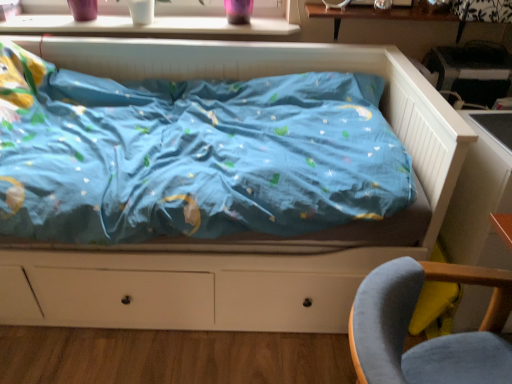
Question: Is velvet grey chair at lower right further to the viewer compared to matte blue bed at center?

Choices:
 (A) no
 (B) yes

Answer: (A)

Question: Considering the relative sizes of velvet grey chair at lower right and matte blue bed at center in the image provided, is velvet grey chair at lower right thinner than matte blue bed at center?

Choices:
 (A) yes
 (B) no

Answer: (A)

Question: Is velvet grey chair at lower right closer to camera compared to matte blue bed at center?

Choices:
 (A) no
 (B) yes

Answer: (B)

Question: Is velvet grey chair at lower right smaller than matte blue bed at center?

Choices:
 (A) yes
 (B) no

Answer: (A)

Question: Is velvet grey chair at lower right taller than matte blue bed at center?

Choices:
 (A) no
 (B) yes

Answer: (A)

Question: Would you say white glossy window sill at upper center is inside or outside wooden table at upper center, the 1th table from the top?

Choices:
 (A) outside
 (B) inside

Answer: (A)

Question: Does point (69, 18) appear closer or farther from the camera than point (394, 6)?

Choices:
 (A) closer
 (B) farther

Answer: (B)

Question: Considering their positions, is white glossy window sill at upper center located in front of or behind wooden table at upper center, the 1th table from the top?

Choices:
 (A) behind
 (B) front

Answer: (A)

Question: Is white glossy window sill at upper center wider or thinner than wooden table at upper center, the 1th table from the top?

Choices:
 (A) thin
 (B) wide

Answer: (B)

Question: Looking at their shapes, would you say white wood table at right, which ranks as the second table in top-to-bottom order, is wider or thinner than velvet grey chair at lower right?

Choices:
 (A) wide
 (B) thin

Answer: (B)

Question: In terms of height, does white wood table at right, positioned as the first table in bottom-to-top order, look taller or shorter compared to velvet grey chair at lower right?

Choices:
 (A) short
 (B) tall

Answer: (B)

Question: Is white wood table at right, which ranks as the second table in top-to-bottom order, to the left or to the right of velvet grey chair at lower right in the image?

Choices:
 (A) right
 (B) left

Answer: (A)

Question: Which is correct: white wood table at right, positioned as the first table in bottom-to-top order, is inside velvet grey chair at lower right, or outside of it?

Choices:
 (A) outside
 (B) inside

Answer: (A)

Question: From a real-world perspective, relative to wooden table at upper center, the 1th table from the top, is white wood table at right, which ranks as the second table in top-to-bottom order, vertically above or below?

Choices:
 (A) below
 (B) above

Answer: (A)

Question: Would you say white wood table at right, positioned as the first table in bottom-to-top order, is to the left or to the right of wooden table at upper center, which is counted as the 2th table, starting from the bottom, in the picture?

Choices:
 (A) left
 (B) right

Answer: (B)